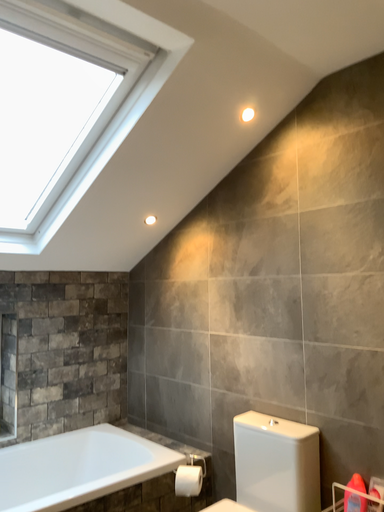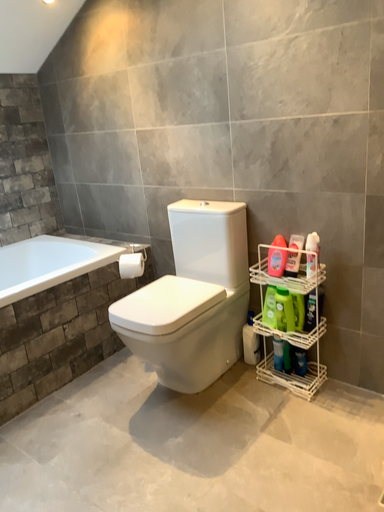
Question: Which way did the camera rotate in the video?

Choices:
 (A) rotated left
 (B) rotated right

Answer: (B)